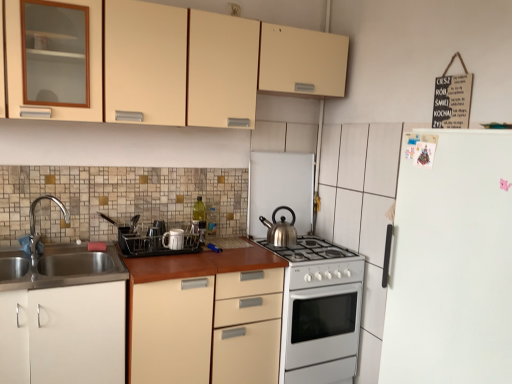
Image resolution: width=512 pixels, height=384 pixels. What do you see at coordinates (281, 189) in the screenshot?
I see `satin silver kettle at center, arranged as the 3th appliance when viewed from the left` at bounding box center [281, 189].

The height and width of the screenshot is (384, 512). Identify the location of brown laminate countertop at center. (205, 317).

Find the location of a particular element. The height and width of the screenshot is (384, 512). white matte refrigerator at right is located at coordinates (451, 261).

Describe the element at coordinates (156, 234) in the screenshot. I see `matte plastic dish rack at center, which ranks as the third appliance in back-to-front order` at that location.

Measure the distance between point [278,240] and camera.

Point [278,240] is 8.88 feet away from camera.

Where is `satin silver kettle at center, the first appliance from the right`? The image size is (512, 384). satin silver kettle at center, the first appliance from the right is located at coordinates (281, 189).

Does brown laminate countertop at center contain satin silver kettle at center, the first appliance from the right?

No, brown laminate countertop at center does not contain satin silver kettle at center, the first appliance from the right.

Looking at this image, considering their positions, is brown laminate countertop at center located in front of or behind satin silver kettle at center, which is the first appliance from back to front?

In the image, brown laminate countertop at center appears in front of satin silver kettle at center, which is the first appliance from back to front.

Is brown laminate countertop at center facing away from satin silver kettle at center, the first appliance from the right?

No, brown laminate countertop at center is not facing away from satin silver kettle at center, the first appliance from the right.

Which point is more distant from viewer, (x=346, y=256) or (x=148, y=245)?

The point (x=346, y=256) is farther from the camera.

Image resolution: width=512 pixels, height=384 pixels. In order to click on oven below the matte plastic dish rack at center, which ranks as the third appliance in back-to-front order (from the image's perspective) in this screenshot , I will do `click(320, 312)`.

Which of these two, white glossy oven at center or matte plastic dish rack at center, which is the 3th appliance in right-to-left order, stands shorter?

Standing shorter between the two is matte plastic dish rack at center, which is the 3th appliance in right-to-left order.

Between white glossy oven at center and matte plastic dish rack at center, which is the 3th appliance in right-to-left order, which one is positioned behind?

Positioned behind is matte plastic dish rack at center, which is the 3th appliance in right-to-left order.

Which point is more forward, (252, 183) or (485, 202)?

The point (485, 202) is more forward.

Is satin silver kettle at center, the first appliance from the right, further to the viewer compared to white matte refrigerator at right?

Yes, the depth of satin silver kettle at center, the first appliance from the right, is greater than that of white matte refrigerator at right.

Could you tell me if satin silver kettle at center, acting as the third appliance starting from the front, is facing white matte refrigerator at right?

Yes, satin silver kettle at center, acting as the third appliance starting from the front, is oriented towards white matte refrigerator at right.

Is satin silver kettle at center, the first appliance from the right, thinner than white matte refrigerator at right?

Yes.

Is white matte refrigerator at right taller than glossy ceramic mug at center, which is the second appliance from right to left?

Indeed, white matte refrigerator at right has a greater height compared to glossy ceramic mug at center, which is the second appliance from right to left.

Between point (447, 289) and point (180, 235), which one is positioned in front?

Point (447, 289)

Is white matte refrigerator at right behind glossy ceramic mug at center, the second appliance when ordered from left to right?

No.

Is white matte refrigerator at right completely or partially outside of glossy ceramic mug at center, marked as the second appliance in a front-to-back arrangement?

Yes, white matte refrigerator at right is located beyond the bounds of glossy ceramic mug at center, marked as the second appliance in a front-to-back arrangement.

How different are the orientations of silver metallic kettle at center and chrome metallic faucet at left in degrees?

The facing directions of silver metallic kettle at center and chrome metallic faucet at left are 80.4 degrees apart.

Between silver metallic kettle at center and chrome metallic faucet at left, which one has more height?

With more height is chrome metallic faucet at left.

The height and width of the screenshot is (384, 512). In order to click on tap on the left side of silver metallic kettle at center in this screenshot , I will do `click(34, 223)`.

Considering the positions of objects silver metallic kettle at center and chrome metallic faucet at left in the image provided, who is more to the right, silver metallic kettle at center or chrome metallic faucet at left?

silver metallic kettle at center.

Considering the points (178, 242) and (36, 204), which point is in front, point (178, 242) or point (36, 204)?

The point (36, 204) is closer to the camera.

In terms of width, does glossy ceramic mug at center, marked as the second appliance in a front-to-back arrangement, look wider or thinner when compared to chrome metallic faucet at left?

Clearly, glossy ceramic mug at center, marked as the second appliance in a front-to-back arrangement, has less width compared to chrome metallic faucet at left.

Which object is further away from the camera taking this photo, glossy ceramic mug at center, which is the second appliance from right to left, or chrome metallic faucet at left?

glossy ceramic mug at center, which is the second appliance from right to left.

From the image's perspective, is glossy ceramic mug at center, the second appliance when ordered from left to right, located beneath chrome metallic faucet at left?

Correct, glossy ceramic mug at center, the second appliance when ordered from left to right, appears lower than chrome metallic faucet at left in the image.

Considering the points (157, 239) and (169, 246), which point is behind, point (157, 239) or point (169, 246)?

The point (157, 239) is farther.

Which is more to the right, matte plastic dish rack at center, which is the first appliance in left-to-right order, or glossy ceramic mug at center, the second appliance when ordered from left to right?

glossy ceramic mug at center, the second appliance when ordered from left to right, is more to the right.

Can you confirm if matte plastic dish rack at center, the 1th appliance from the front, is thinner than glossy ceramic mug at center, marked as the second appliance in a front-to-back arrangement?

No, matte plastic dish rack at center, the 1th appliance from the front, is not thinner than glossy ceramic mug at center, marked as the second appliance in a front-to-back arrangement.

Is matte plastic dish rack at center, the 1th appliance from the front, oriented towards glossy ceramic mug at center, which is the second appliance from right to left?

No, matte plastic dish rack at center, the 1th appliance from the front, is not aimed at glossy ceramic mug at center, which is the second appliance from right to left.

Identify the location of the 3rd appliance located above the brown laminate countertop at center (from a real-world perspective). (281, 189).

Where is `oven below the matte plastic dish rack at center, which ranks as the third appliance in back-to-front order (from a real-world perspective)`? oven below the matte plastic dish rack at center, which ranks as the third appliance in back-to-front order (from a real-world perspective) is located at coordinates (320, 312).

In the scene shown: When comparing their distances from chrome metallic faucet at left, does satin silver kettle at center, the first appliance from the right, or white glossy oven at center seem further?

white glossy oven at center lies further to chrome metallic faucet at left than the other object.

Based on the photo, considering their positions, is white matte cabinet at lower left, the first cabinetry from the bottom, positioned further to satin silver kettle at center, arranged as the 3th appliance when viewed from the left, than white matte refrigerator at right?

white matte refrigerator at right is further to satin silver kettle at center, arranged as the 3th appliance when viewed from the left.

When comparing their distances from matte beige cabinet at upper center, which appears as the 1th cabinetry when viewed from the top, does satin silver kettle at center, arranged as the 3th appliance when viewed from the left, or white glossy oven at center seem closer?

Based on the image, satin silver kettle at center, arranged as the 3th appliance when viewed from the left, appears to be nearer to matte beige cabinet at upper center, which appears as the 1th cabinetry when viewed from the top.

From the image, which object appears to be nearer to matte plastic dish rack at center, which is the first appliance in left-to-right order, silver metallic kettle at center or white glossy oven at center?

silver metallic kettle at center is closer to matte plastic dish rack at center, which is the first appliance in left-to-right order.

Estimate the real-world distances between objects in this image. Which object is closer to white matte cabinet at lower left, the first cabinetry from the bottom, matte beige cabinet at upper center, which appears as the 1th cabinetry when viewed from the top, or glossy ceramic mug at center, marked as the second appliance in a front-to-back arrangement?

Among the two, glossy ceramic mug at center, marked as the second appliance in a front-to-back arrangement, is located nearer to white matte cabinet at lower left, the first cabinetry from the bottom.

From the picture: When comparing their distances from white matte cabinet at lower left, the first cabinetry from the bottom, does satin silver kettle at center, arranged as the 3th appliance when viewed from the left, or matte plastic dish rack at center, which ranks as the third appliance in back-to-front order, seem closer?

Based on the image, matte plastic dish rack at center, which ranks as the third appliance in back-to-front order, appears to be nearer to white matte cabinet at lower left, the first cabinetry from the bottom.

Looking at the image, which one is located further to silver metallic kettle at center, matte beige cabinet at upper center, which appears as the 1th cabinetry when viewed from the top, or white glossy gas stove at center?

matte beige cabinet at upper center, which appears as the 1th cabinetry when viewed from the top.

Estimate the real-world distances between objects in this image. Which object is closer to white matte refrigerator at right, silver metallic kettle at center or matte beige cabinet at upper center, which appears as the 1th cabinetry when viewed from the top?

The object closer to white matte refrigerator at right is matte beige cabinet at upper center, which appears as the 1th cabinetry when viewed from the top.

You are a GUI agent. You are given a task and a screenshot of the screen. Output one action in this format:
    pyautogui.click(x=<x>, y=<y>)
    Task: Click on the kitchen appliance between matte beige cabinet at upper center, which appears as the 1th cabinetry when viewed from the top, and white glossy gas stove at center, in the vertical direction
    
    Given the screenshot: What is the action you would take?
    pyautogui.click(x=280, y=229)

Identify the location of cabinetry situated between chrome metallic faucet at left and brown laminate countertop at center from left to right. (63, 334).

Find the location of a particular element. This screenshot has height=384, width=512. gas stove between matte beige cabinet at upper center, which appears as the 1th cabinetry when viewed from the top, and brown laminate countertop at center vertically is located at coordinates pyautogui.click(x=319, y=263).

You are a GUI agent. You are given a task and a screenshot of the screen. Output one action in this format:
    pyautogui.click(x=<x>, y=<y>)
    Task: Click on the appliance that lies between matte beige cabinet at upper center, which appears as the 1th cabinetry when viewed from the top, and matte plastic dish rack at center, which ranks as the third appliance in back-to-front order, from top to bottom
    
    Given the screenshot: What is the action you would take?
    (x=281, y=189)